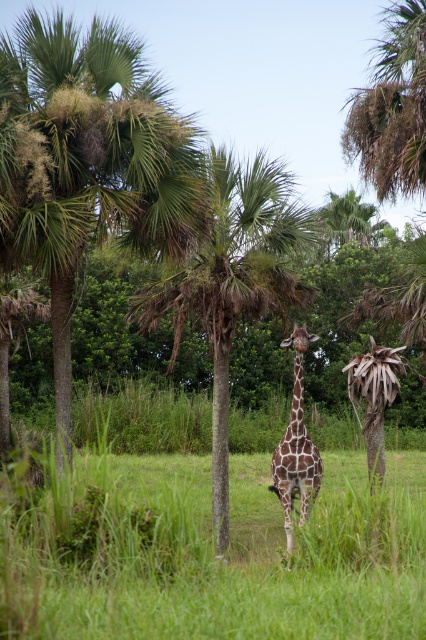
You are standing in the scene and want to take a photo of the green leafy palm tree at left. If your camera has a maximum focus range of 10 meters, will you be able to capture it clearly?

The green leafy palm tree at left is 11.44 meters away from the viewer, which exceeds the camera maximum focus range of 10 meters. Therefore, the camera cannot focus on it clearly.

You are a photographer trying to capture the giraffe in the scene. You notice two points marked in the image. The first point is at coordinate point (28, 102) and the second is at point (276, 448). Which point is nearer to the camera?

Point (28, 102) is closer to the camera than point (276, 448).

Consider the image. You are a photographer trying to capture the spotted fur giraffe at center. However, there is a green leafy palm tree at center blocking your view. Can you move to the left or right to get a clear shot of the giraffe without the palm tree in the way?

The spotted fur giraffe at center is behind the green leafy palm tree at center. Since both are at the center, moving left or right might not fully eliminate the obstruction. Adjust your angle slightly to the side where the palm tree branches are thinner or less dense for a clearer view.